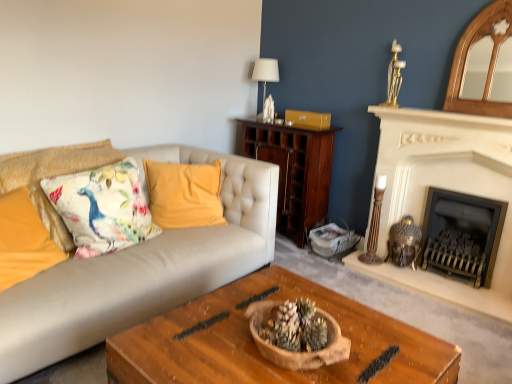
Question: Considering the positions of wooden bowl at center and black metal fireplace at right, which is counted as the 2th fireplace, starting from the left, in the image, is wooden bowl at center wider or thinner than black metal fireplace at right, which is counted as the 2th fireplace, starting from the left,?

Choices:
 (A) wide
 (B) thin

Answer: (A)

Question: Looking at the image, does wooden bowl at center seem bigger or smaller compared to black metal fireplace at right, which is counted as the 2th fireplace, starting from the left?

Choices:
 (A) big
 (B) small

Answer: (A)

Question: Which of these objects is positioned farthest from the wooden candle holder at right, placed as the first candle holder when sorted from bottom to top?

Choices:
 (A) white fabric lampshade at upper center
 (B) velvet yellow pillow at center, the 3th pillow when ordered from left to right
 (C) floral fabric cushion at left, which appears as the 2th pillow when viewed from the right
 (D) white stone fireplace at right, arranged as the 2th fireplace when viewed from the right
 (E) black metal fireplace at right, the 1th fireplace viewed from the right

Answer: (C)

Question: Estimate the real-world distances between objects in this image. Which object is farther from the wooden candle holder at right, placed as the first candle holder when sorted from bottom to top?

Choices:
 (A) floral fabric cushion at left
 (B) gold metallic candle holder at upper right, which is the first candle holder in top-to-bottom order
 (C) velvet yellow pillow at center, the 3th pillow when ordered from left to right
 (D) floral fabric cushion at left, which ranks as the 1th pillow in left-to-right order
 (E) white stone fireplace at right, positioned as the 1th fireplace in left-to-right order

Answer: (D)